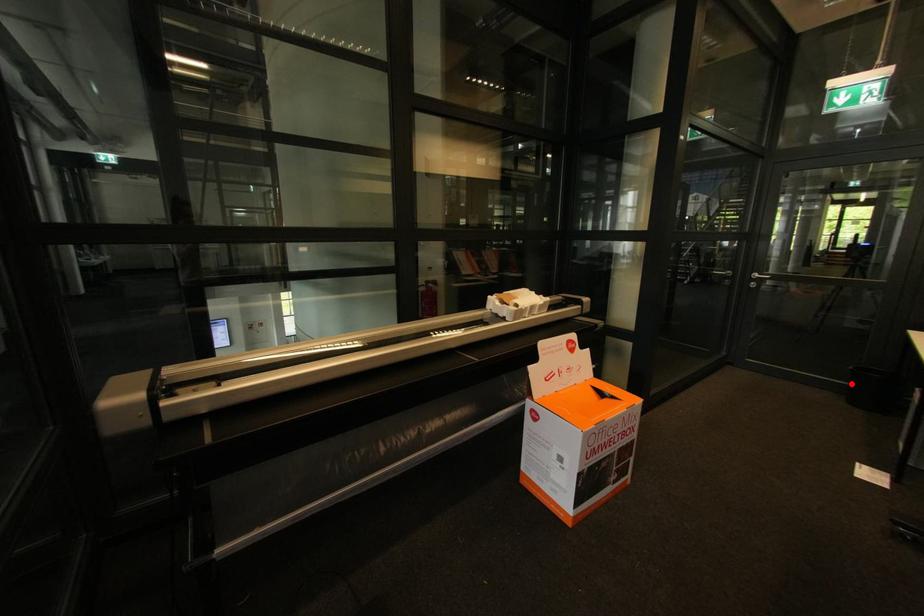
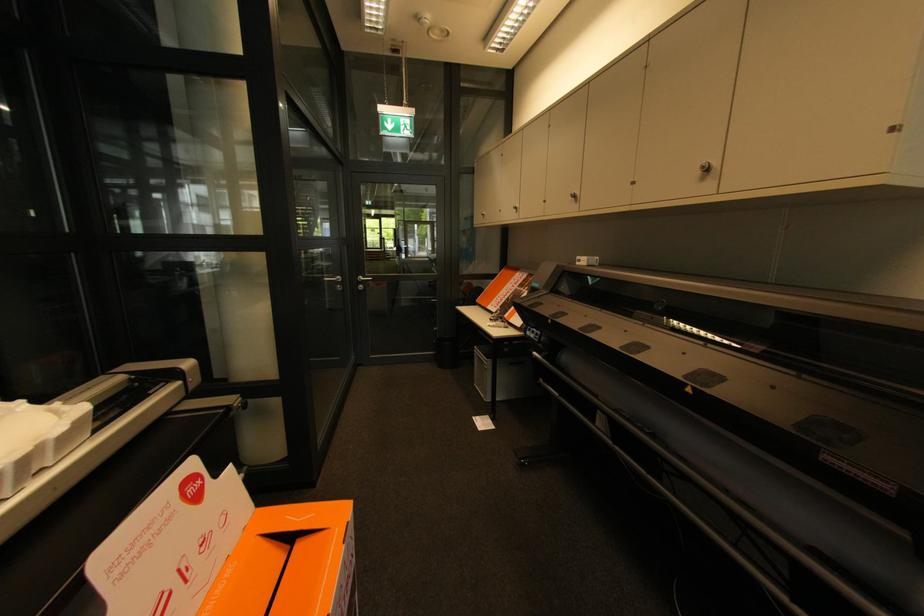
Question: I am providing you with two images of the same scene from different viewpoints. A red point is shown in image1. For the corresponding object point in image2, is it positioned nearer or farther from the camera?

Choices:
 (A) Nearer
 (B) Farther

Answer: (A)